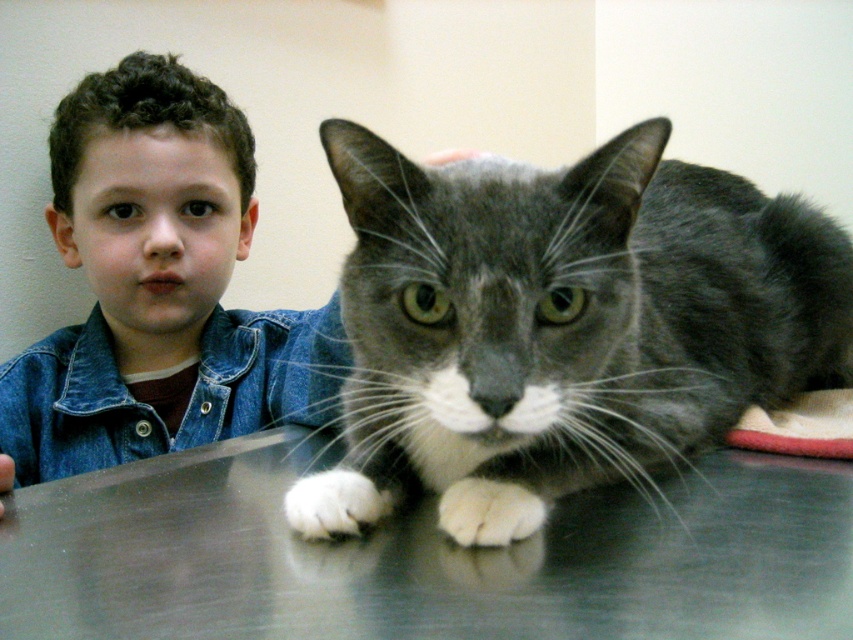
Question: Can you confirm if brushed denim jacket at lower left is positioned to the right of white fluffy paw at lower center?

Choices:
 (A) yes
 (B) no

Answer: (B)

Question: Which of the following is the farthest from the observer?

Choices:
 (A) (193, 387)
 (B) (509, 563)
 (C) (473, 528)
 (D) (109, 460)

Answer: (A)

Question: Is gray fur cat at center to the left of denim jacket at left from the viewer's perspective?

Choices:
 (A) yes
 (B) no

Answer: (B)

Question: Which object appears farthest from the camera in this image?

Choices:
 (A) white fluffy paw at lower center
 (B) metallic gray table at center
 (C) denim jacket at left
 (D) white fur at lower center

Answer: (C)

Question: Which point is closer to the camera?

Choices:
 (A) gray fur cat at center
 (B) white fluffy paw at lower center

Answer: (A)

Question: Can you confirm if gray fur cat at center is positioned to the left of white fluffy paw at lower center?

Choices:
 (A) yes
 (B) no

Answer: (B)